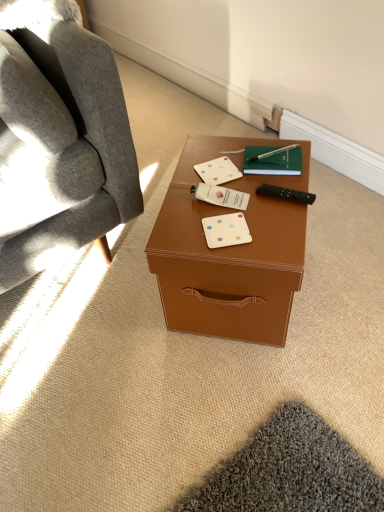
Question: Considering the positions of brown leather desk at center and soft gray fabric chair at left in the image, is brown leather desk at center taller or shorter than soft gray fabric chair at left?

Choices:
 (A) tall
 (B) short

Answer: (B)

Question: Visually, is brown leather desk at center positioned to the left or to the right of soft gray fabric chair at left?

Choices:
 (A) right
 (B) left

Answer: (A)

Question: Which is farther from the black plastic remote control at right?

Choices:
 (A) brown leather desk at center
 (B) white matte business card at center, marked as the third business card in a bottom-to-top arrangement
 (C) white matte business card at center, placed as the third business card when sorted from top to bottom
 (D) green matte notebook at center
 (E) soft gray fabric chair at left

Answer: (E)

Question: Considering the real-world distances, which object is farthest from the white matte business card at center, the 1th business card viewed from the front?

Choices:
 (A) soft gray fabric chair at left
 (B) black plastic remote control at right
 (C) white matte business card at center, marked as the 2th business card in a back-to-front arrangement
 (D) green matte notebook at center
 (E) brown leather desk at center

Answer: (A)